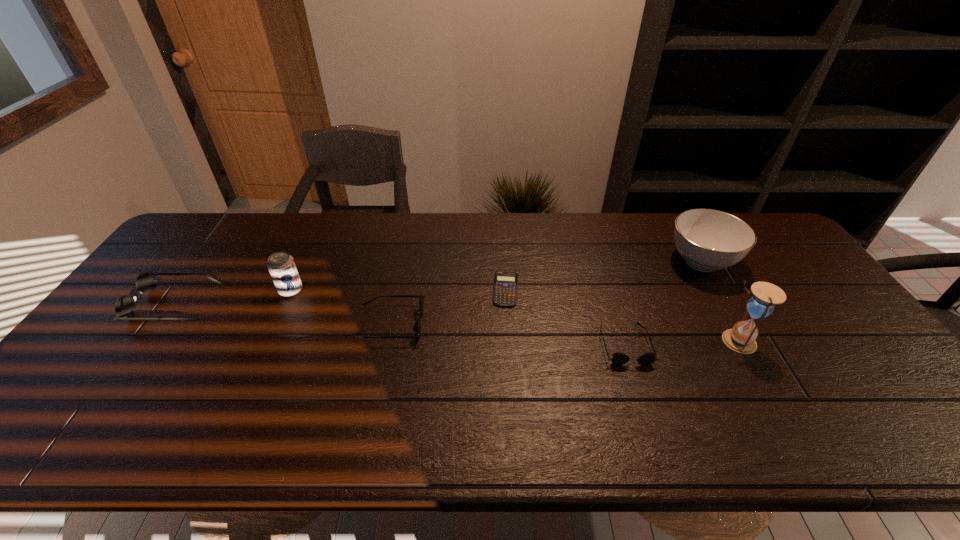
In order to click on the leftmost sunglasses in this screenshot , I will do `click(124, 308)`.

I want to click on the leftmost object, so click(124, 308).

Locate an element on the screen. This screenshot has width=960, height=540. the third object from left to right is located at coordinates (417, 326).

The image size is (960, 540). In order to click on the fifth tallest object in this screenshot , I will do `click(417, 326)`.

In order to click on the second shortest object in this screenshot , I will do `click(618, 358)`.

At what (x,y) coordinates should I click in order to perform the action: click on the third object from right to left. Please return your answer as a coordinate pair (x, y). The image size is (960, 540). Looking at the image, I should click on point(618,358).

Find the location of a particular element. This screenshot has width=960, height=540. the second object from left to right is located at coordinates (282, 268).

At what (x,y) coordinates should I click in order to perform the action: click on chinaware. Please return your answer as a coordinate pair (x, y). Looking at the image, I should click on (708, 240).

Identify the location of the fourth object from left to right. This screenshot has height=540, width=960. (505, 288).

You are a GUI agent. You are given a task and a screenshot of the screen. Output one action in this format:
    pyautogui.click(x=<x>, y=<y>)
    Task: Click on the calculator
    The image size is (960, 540).
    Given the screenshot: What is the action you would take?
    pyautogui.click(x=505, y=288)